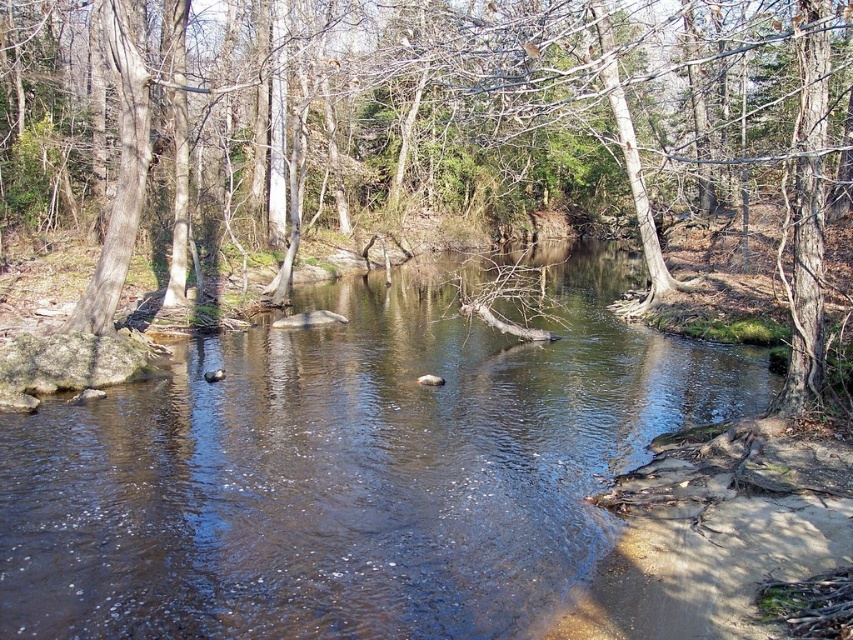
You are a hiker carrying a heavy backpack and need to cross the stream. The brown smooth river at center is flowing gently, and there is a brown bark tree at center nearby. Considering the distance between them, can you safely reach the tree from the riverbank without getting your backpack wet?

The brown smooth river at center and brown bark tree at center are 12.84 meters apart from each other. Since the distance is significant, you would need to find a way to cross the river safely, possibly by looking for a wider or shallower section of the stream to ensure you can reach the tree without getting your backpack wet.

You are a hiker who wants to cross the stream using a fallen tree trunk. You see the brown smooth river at center and the brown bark tree at center. Which object is wider and can support your weight better for crossing?

The brown bark tree at center is wider than the brown smooth river at center, so it can support your weight better for crossing.